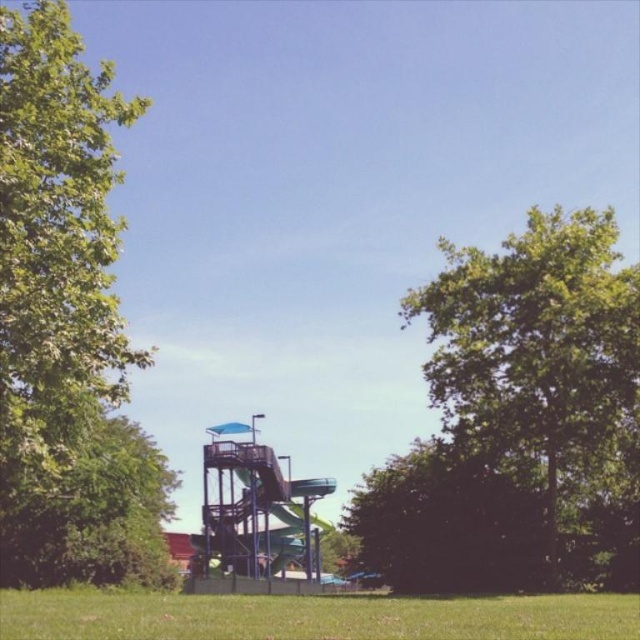
You are standing at the center of the grassy field in the foreground. You want to walk towards the base of the green leafy tree at right. Which direction should you head?

The green leafy tree at right is located at coordinates point (540, 365), so you should head to the right direction to reach it.

You are standing at the base of the water slide structure and want to walk towards the point marked as point (250, 522). However, there is an obstacle at point (74, 397). Will you encounter the obstacle before reaching your destination?

Yes, you will encounter the obstacle at point (74, 397) before reaching point (250, 522) because point (74, 397) is in front of point (250, 522).

You are planning to install a new water feature near the green leafy tree at left and the metallic blue slide at center. Considering their heights, which object would cast a longer shadow at noon?

The green leafy tree at left has a greater height compared to the metallic blue slide at center, so it would cast a longer shadow at noon.